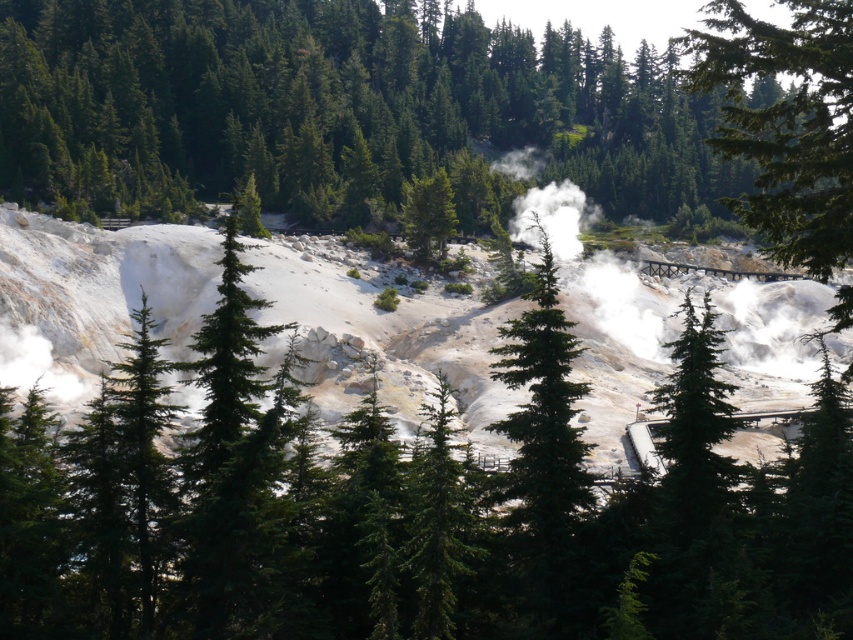
Does green textured tree at center have a lesser height compared to green matte tree at center?

Incorrect, green textured tree at center's height does not fall short of green matte tree at center's.

Based on the photo, can you confirm if green textured tree at center is bigger than green matte tree at center?

Yes, green textured tree at center is bigger than green matte tree at center.

This screenshot has width=853, height=640. What are the coordinates of `green textured tree at center` in the screenshot? It's located at (786, 124).